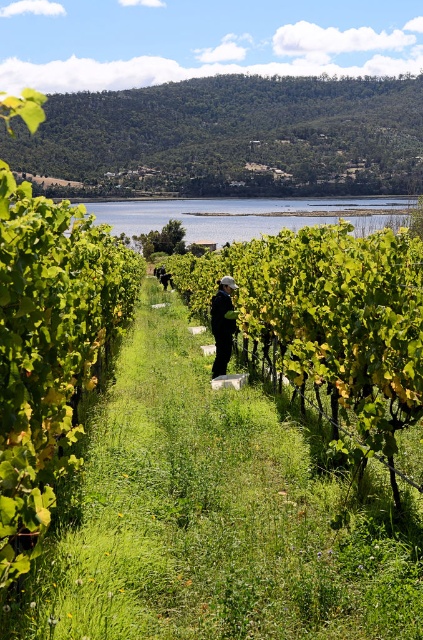
Question: Estimate the real-world distances between objects in this image. Which object is farther from the dark green fabric at center?

Choices:
 (A) green leafy vine at center
 (B) clear water at center

Answer: (B)

Question: Does green leafy vine at center appear under dark green fabric at center?

Choices:
 (A) no
 (B) yes

Answer: (A)

Question: Which of the following is the farthest from the observer?

Choices:
 (A) green leafy vine at center
 (B) clear water at center

Answer: (B)

Question: Is green leafy vine at center thinner than clear water at center?

Choices:
 (A) yes
 (B) no

Answer: (A)

Question: Which point appears closest to the camera in this image?

Choices:
 (A) (227, 276)
 (B) (297, 228)

Answer: (A)

Question: Is clear water at center behind dark green fabric at center?

Choices:
 (A) yes
 (B) no

Answer: (A)